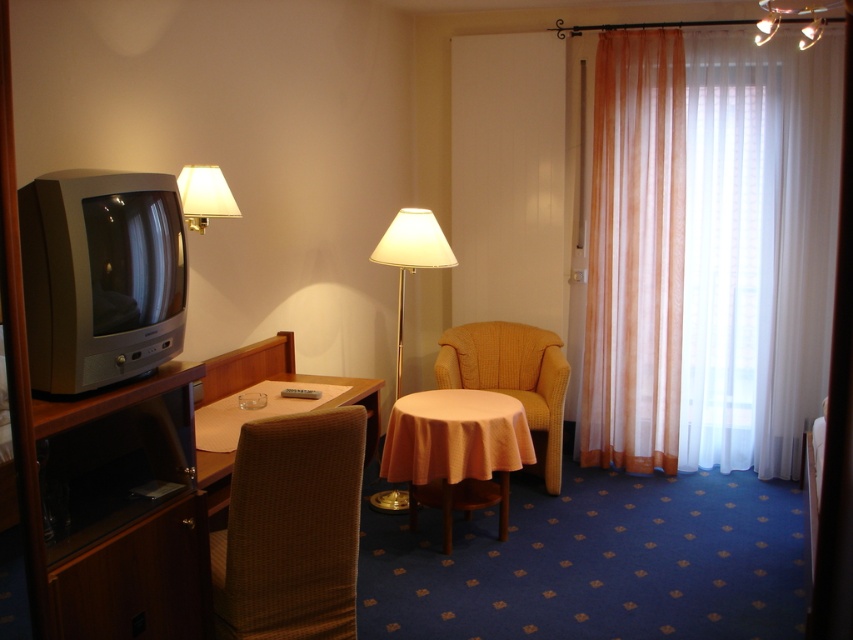
Is point (534, 356) in front of point (222, 464)?

No, (534, 356) is behind (222, 464).

Looking at this image, which is below, yellow knitted armchair at center or matte brown table at center?

yellow knitted armchair at center is below.

Is point (503, 387) positioned after point (234, 387)?

Yes.

Find the location of a particular element. The image size is (853, 640). yellow knitted armchair at center is located at coordinates (512, 378).

Does translucent white curtain at right have a smaller size compared to orange fabric table at center?

No.

Does point (761, 52) lie in front of point (399, 456)?

No.

Find the location of a particular element. translucent white curtain at right is located at coordinates (757, 246).

Can you confirm if translucent white curtain at right is positioned below white fabric lampshade at upper left?

Correct, translucent white curtain at right is located below white fabric lampshade at upper left.

The image size is (853, 640). I want to click on translucent white curtain at right, so click(x=757, y=246).

Image resolution: width=853 pixels, height=640 pixels. What are the coordinates of `translucent white curtain at right` in the screenshot? It's located at (757, 246).